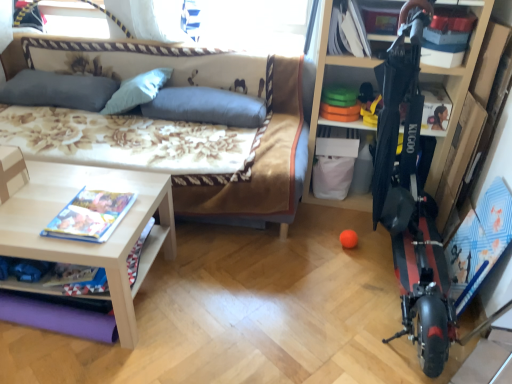
The image size is (512, 384). Find the location of `empty space that is ontop of gray fabric pillow at upper left, marked as the third pillow in a right-to-left arrangement (from a real-world perspective)`. empty space that is ontop of gray fabric pillow at upper left, marked as the third pillow in a right-to-left arrangement (from a real-world perspective) is located at coordinates (55, 77).